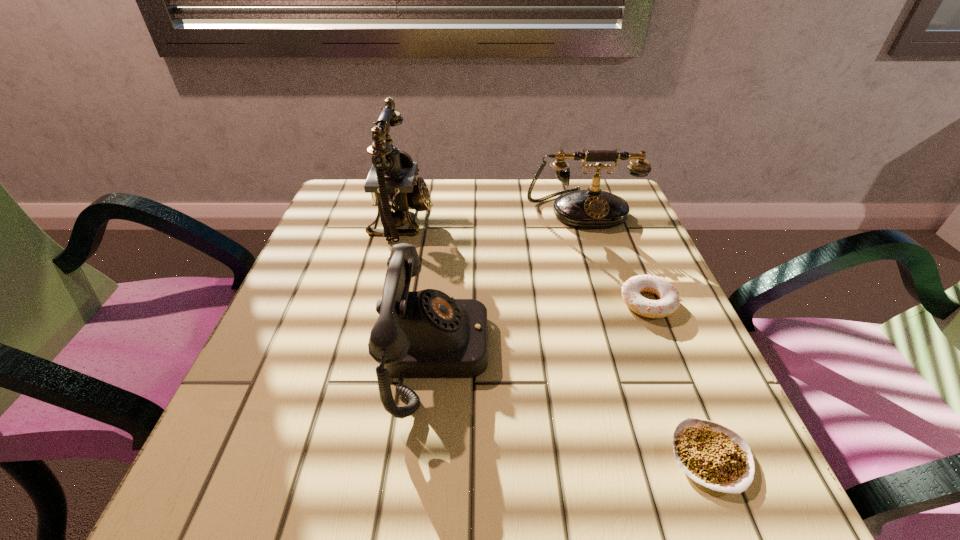
Where is `free space that satisfies the following two spatial constraints: 1. on the rotary dial of the tallest telephone; 2. on the left side of the fourth tallest object`? free space that satisfies the following two spatial constraints: 1. on the rotary dial of the tallest telephone; 2. on the left side of the fourth tallest object is located at coordinates click(x=382, y=302).

This screenshot has height=540, width=960. I want to click on vacant area that satisfies the following two spatial constraints: 1. on the dial of the rightmost telephone; 2. on the dial of the nearest telephone, so click(626, 353).

You are a GUI agent. You are given a task and a screenshot of the screen. Output one action in this format:
    pyautogui.click(x=<x>, y=<y>)
    Task: Click on the vacant area that satisfies the following two spatial constraints: 1. on the dial of the fourth tallest object; 2. on the right side of the rightmost telephone
    
    Given the screenshot: What is the action you would take?
    pyautogui.click(x=611, y=302)

Identify the location of free space that satisfies the following two spatial constraints: 1. on the dial of the nearest telephone; 2. on the left side of the shortest object. The image size is (960, 540). (425, 457).

Locate an element on the screen. The width and height of the screenshot is (960, 540). vacant space that satisfies the following two spatial constraints: 1. on the back side of the shortest object; 2. on the dial of the nearest telephone is located at coordinates (667, 353).

I want to click on vacant region that satisfies the following two spatial constraints: 1. on the rotary dial of the doughnut; 2. on the right side of the tallest telephone, so click(382, 302).

Identify the location of free space that satisfies the following two spatial constraints: 1. on the dial of the rightmost telephone; 2. on the right side of the second shortest object. (611, 302).

Find the location of a particular element. vacant region that satisfies the following two spatial constraints: 1. on the dial of the nearest telephone; 2. on the right side of the shortest object is located at coordinates (425, 457).

Identify the location of vacant position in the image that satisfies the following two spatial constraints: 1. on the dial of the rightmost telephone; 2. on the rotary dial of the tallest object. This screenshot has width=960, height=540. (585, 220).